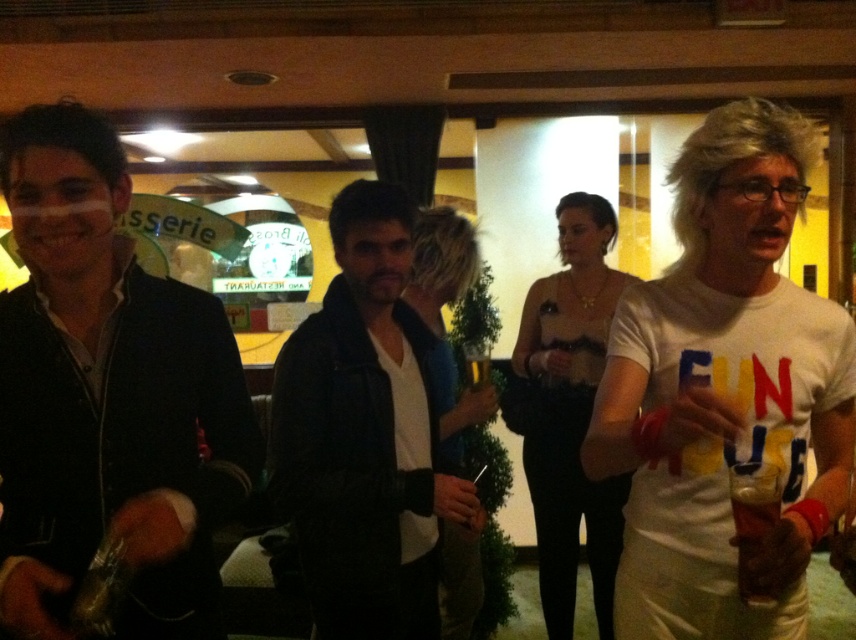
You are standing at point [331,225] and want to walk to the exit located at point [649,440]. Is the exit directly in front of you or behind you?

The exit at point [649,440] is in front of you because it is located in front of point [331,225] where you are standing.